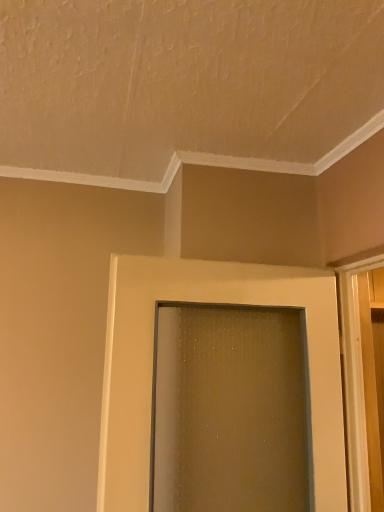
This screenshot has height=512, width=384. What do you see at coordinates (152, 364) in the screenshot? I see `matte glass door at center` at bounding box center [152, 364].

What is the approximate height of matte glass door at center?

The height of matte glass door at center is 34.33 inches.

The image size is (384, 512). I want to click on matte glass door at center, so click(x=152, y=364).

This screenshot has width=384, height=512. Identify the location of matte glass door at center. (152, 364).